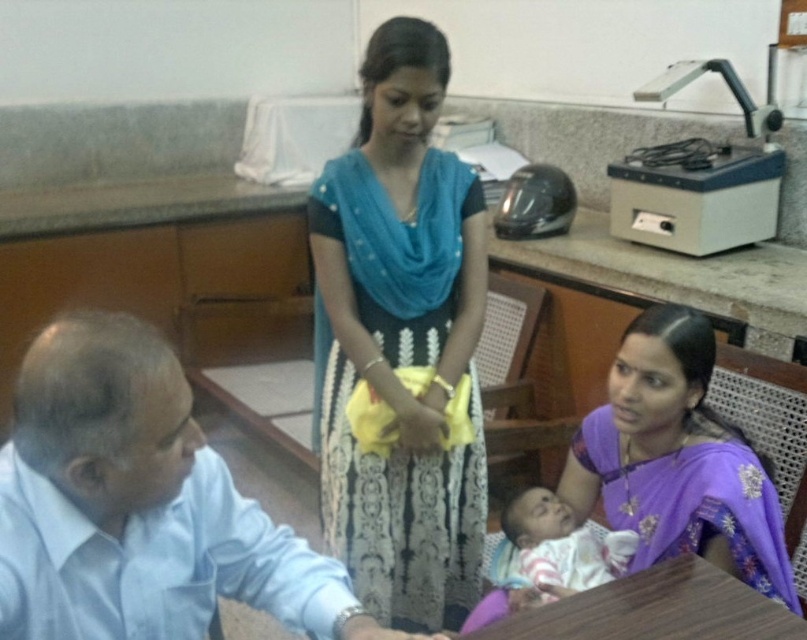
Question: Does wooden table at lower center have a greater width compared to soft pink fabric baby at lower center?

Choices:
 (A) yes
 (B) no

Answer: (A)

Question: Which point is closer to the camera?

Choices:
 (A) (651, 577)
 (B) (383, 189)

Answer: (A)

Question: Considering the relative positions of purple silk saree at lower right and wooden table at lower center in the image provided, where is purple silk saree at lower right located with respect to wooden table at lower center?

Choices:
 (A) left
 (B) right

Answer: (B)

Question: Estimate the real-world distances between objects in this image. Which object is farther from the light blue shirt at left?

Choices:
 (A) purple silk saree at lower right
 (B) soft pink fabric baby at lower center

Answer: (A)

Question: Does light blue shirt at left appear on the right side of purple silk saree at lower right?

Choices:
 (A) no
 (B) yes

Answer: (A)

Question: Which point is closer to the camera?

Choices:
 (A) (354, 269)
 (B) (709, 627)
 (C) (776, 586)

Answer: (B)